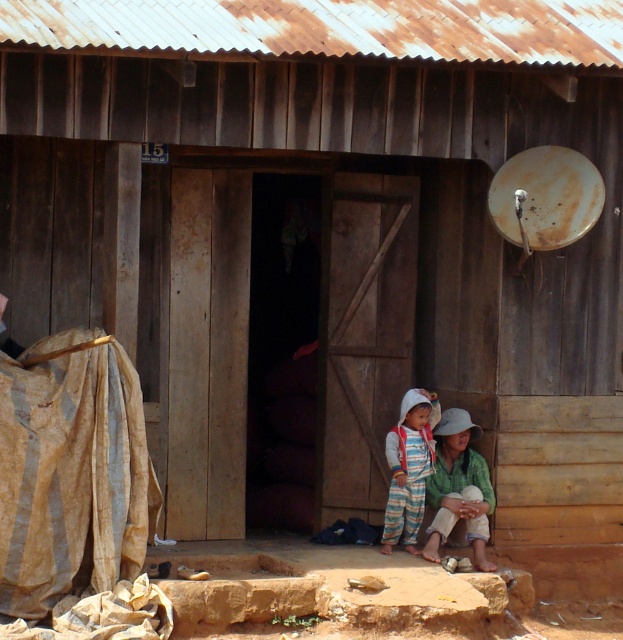
Question: Is light brown fabric at lower center to the left of light gray cotton pants at center from the viewer's perspective?

Choices:
 (A) yes
 (B) no

Answer: (B)

Question: Which point appears farthest from the camera in this image?

Choices:
 (A) (417, 426)
 (B) (495, 568)

Answer: (A)

Question: Where is light brown fabric at lower center located in relation to light gray cotton pants at center in the image?

Choices:
 (A) left
 (B) right

Answer: (B)

Question: Is light brown fabric at lower center to the left of light gray cotton pants at center from the viewer's perspective?

Choices:
 (A) yes
 (B) no

Answer: (B)

Question: Which point is farther to the camera?

Choices:
 (A) light gray cotton pants at center
 (B) light brown fabric at lower center

Answer: (A)

Question: Which point appears farthest from the camera in this image?

Choices:
 (A) (462, 445)
 (B) (399, 515)

Answer: (A)